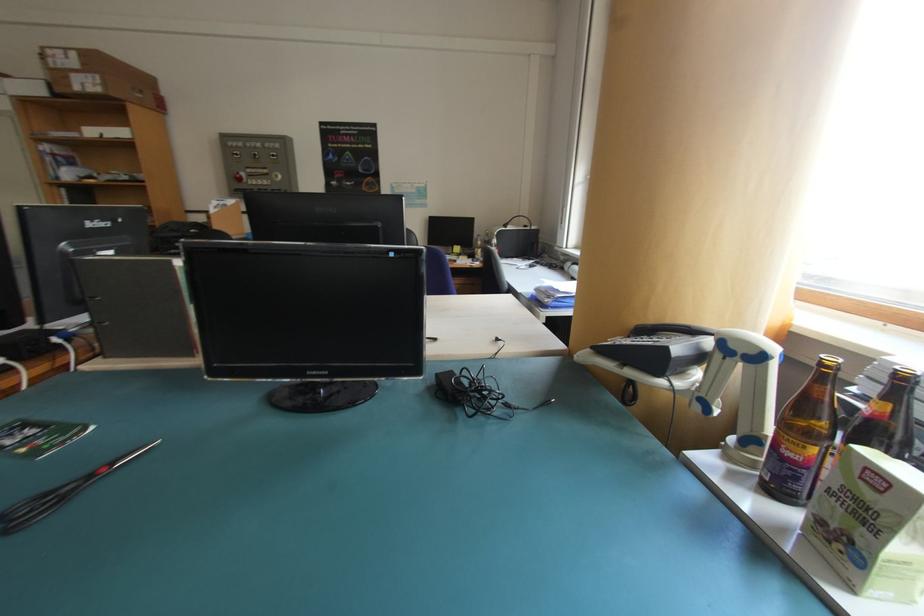
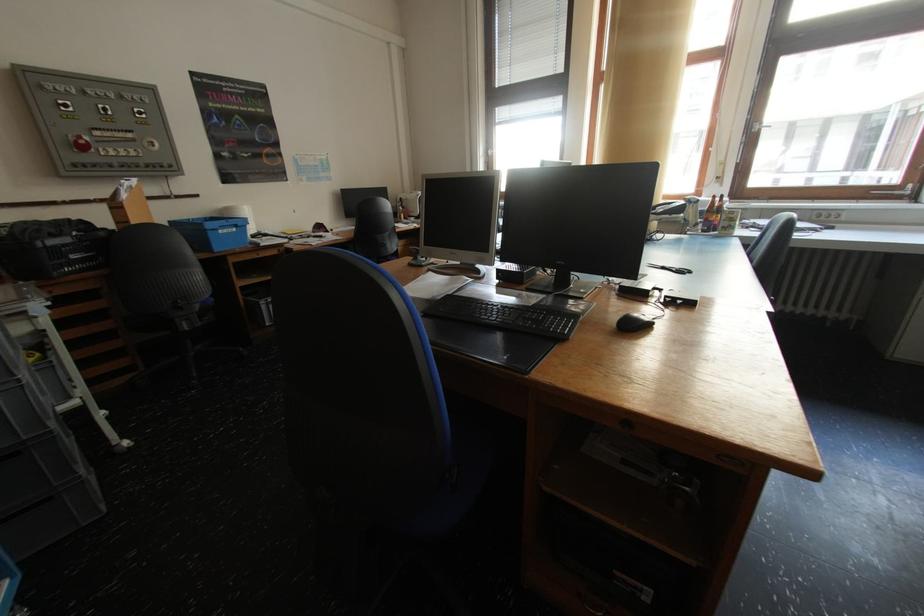
In the second image, find the point that corresponds to pixel 248 180 in the first image.

(91, 148)